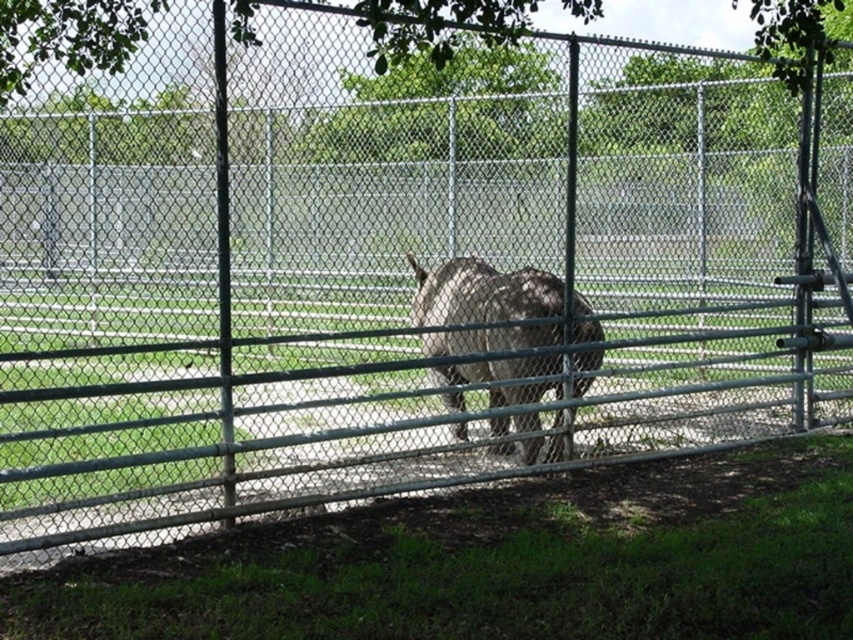
You are standing in front of the fenced enclosure with the donkey. There are two points marked on the enclosure fence at coordinates point (456, 67) and point (532, 340). Which point is closer to you?

Point (456, 67) is closer to the viewer than point (532, 340).

You are a zookeeper who needs to trim the branches of the green leafy tree at upper center. Your ladder can reach up to 5 meters. Can you safely trim the branches from the ground without needing a taller ladder?

The green leafy tree at upper center is 5.87 meters away from the camera. Since your ladder can only reach up to 5 meters, you cannot safely trim the branches without needing a taller ladder.

You are a visitor at the zoo and want to take a photo of the gray fur at center and the green leafy tree at upper center. Which object should you focus on first if you want to include both in your photo without moving the camera?

You should focus on the green leafy tree at upper center first because it might be wider than the gray fur at center, so capturing its width first ensures both are in frame.